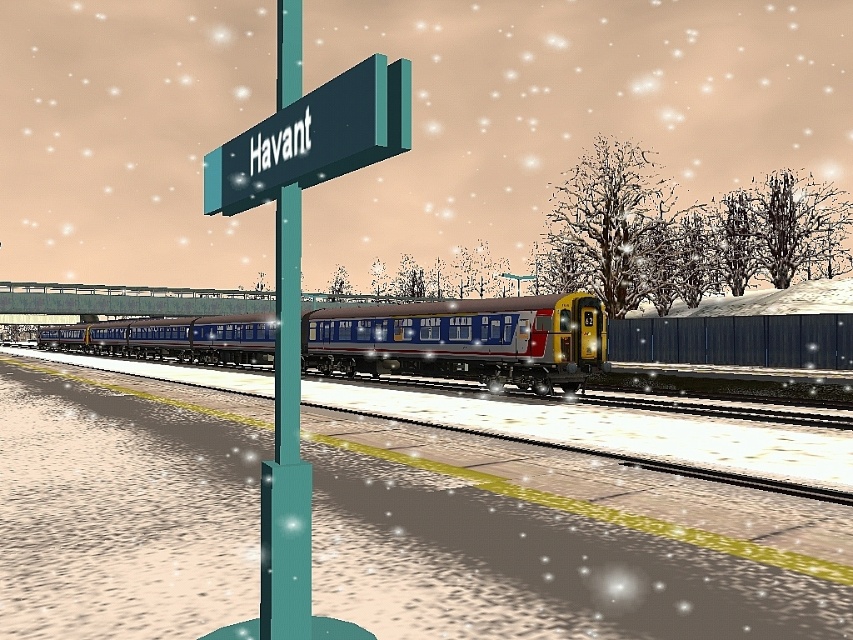
Question: Estimate the real-world distances between objects in this image. Which object is closer to the metallic blue train at center?

Choices:
 (A) teal glossy signpost at center
 (B) green matte signboard at upper center

Answer: (B)

Question: Can you confirm if teal glossy signpost at center is thinner than green matte signboard at upper center?

Choices:
 (A) yes
 (B) no

Answer: (A)

Question: Which of the following is the closest to the observer?

Choices:
 (A) green matte signboard at upper center
 (B) teal glossy signpost at center
 (C) metallic blue train at center

Answer: (A)

Question: Is metallic blue train at center positioned in front of green matte signboard at upper center?

Choices:
 (A) no
 (B) yes

Answer: (A)

Question: Can you confirm if teal glossy signpost at center is positioned below green matte signboard at upper center?

Choices:
 (A) no
 (B) yes

Answer: (B)

Question: Which of these objects is positioned closest to the metallic blue train at center?

Choices:
 (A) teal glossy signpost at center
 (B) green matte signboard at upper center

Answer: (B)